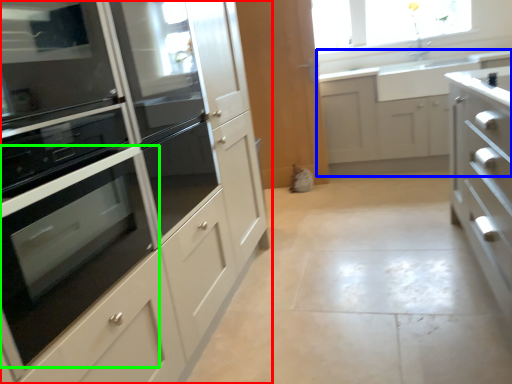
Question: Which object is the farthest from cabinetry (highlighted by a red box)? Choose among these: cabinetry (highlighted by a blue box) or oven (highlighted by a green box).

Choices:
 (A) cabinetry
 (B) oven

Answer: (A)